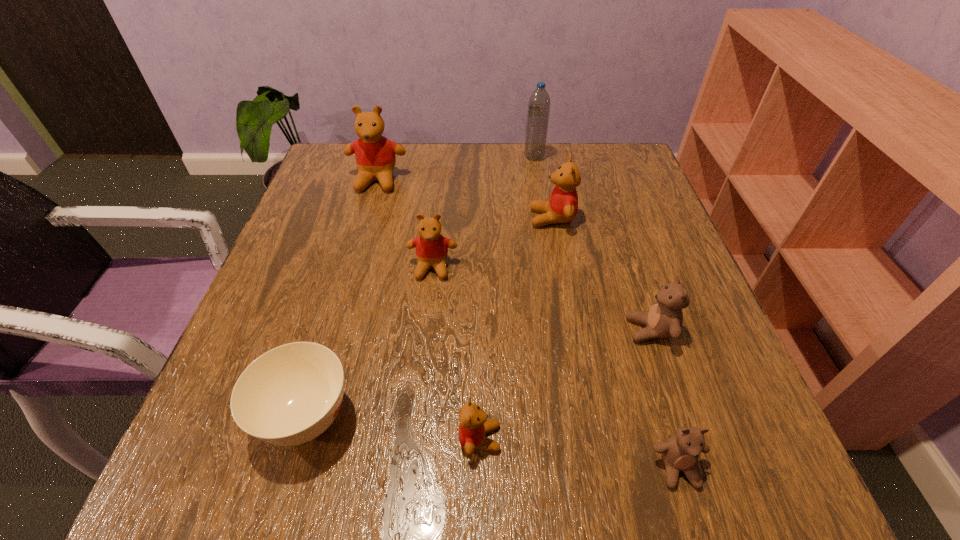
Identify which object is located as the fifth nearest to the sixth object from right to left. Please provide its 2D coordinates. Your answer should be formatted as a tuple, i.e. [(x, y)], where the tuple contains the x and y coordinates of a point satisfying the conditions above.

[(664, 319)]

Select which object appears as the fourth closest to the farthest object. Please provide its 2D coordinates. Your answer should be formatted as a tuple, i.e. [(x, y)], where the tuple contains the x and y coordinates of a point satisfying the conditions above.

[(664, 319)]

Select which teddy bear is the third closest to the leftmost red teddy bear. Please provide its 2D coordinates. Your answer should be formatted as a tuple, i.e. [(x, y)], where the tuple contains the x and y coordinates of a point satisfying the conditions above.

[(664, 319)]

Select which teddy bear appears as the fifth closest to the third red teddy bear from right to left. Please provide its 2D coordinates. Your answer should be formatted as a tuple, i.e. [(x, y)], where the tuple contains the x and y coordinates of a point satisfying the conditions above.

[(681, 452)]

Find the location of a particular element. the second closest red teddy bear relative to the water bottle is located at coordinates 375,155.

Identify which red teddy bear is the nearest to the sugar bowl. Please provide its 2D coordinates. Your answer should be formatted as a tuple, i.e. [(x, y)], where the tuple contains the x and y coordinates of a point satisfying the conditions above.

[(473, 424)]